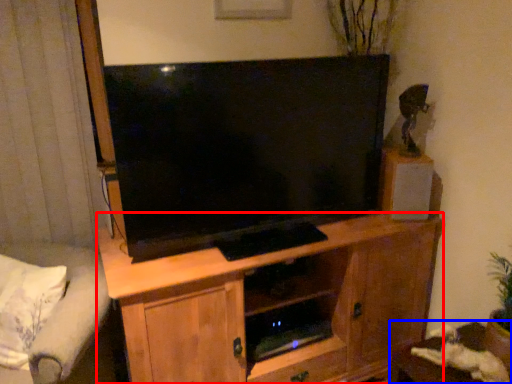
Question: Which object is further to the camera taking this photo, cabinetry (highlighted by a red box) or table (highlighted by a blue box)?

Choices:
 (A) cabinetry
 (B) table

Answer: (B)